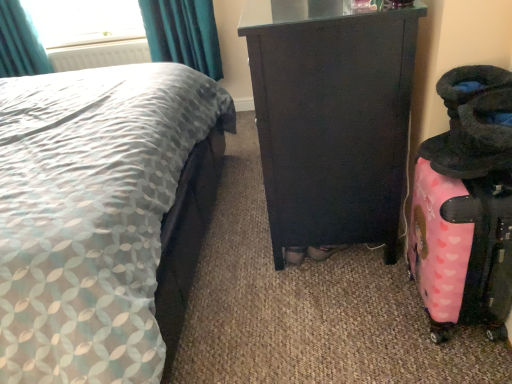
Question: Does teal fabric curtain at upper left turn towards matte gray fabric bed at left?

Choices:
 (A) yes
 (B) no

Answer: (A)

Question: Is teal fabric curtain at upper left next to matte gray fabric bed at left?

Choices:
 (A) yes
 (B) no

Answer: (B)

Question: Considering the relative positions of teal fabric curtain at upper left and matte gray fabric bed at left in the image provided, is teal fabric curtain at upper left to the right of matte gray fabric bed at left from the viewer's perspective?

Choices:
 (A) yes
 (B) no

Answer: (B)

Question: Is teal fabric curtain at upper left oriented away from matte gray fabric bed at left?

Choices:
 (A) yes
 (B) no

Answer: (B)

Question: Does teal fabric curtain at upper left appear on the left side of matte gray fabric bed at left?

Choices:
 (A) no
 (B) yes

Answer: (B)

Question: Is point (325, 44) closer or farther from the camera than point (64, 147)?

Choices:
 (A) closer
 (B) farther

Answer: (A)

Question: Considering the positions of matte black cabinet at center and matte gray fabric bed at left in the image, is matte black cabinet at center wider or thinner than matte gray fabric bed at left?

Choices:
 (A) wide
 (B) thin

Answer: (B)

Question: Based on their sizes in the image, would you say matte black cabinet at center is bigger or smaller than matte gray fabric bed at left?

Choices:
 (A) big
 (B) small

Answer: (B)

Question: Considering their positions, is matte black cabinet at center located in front of or behind matte gray fabric bed at left?

Choices:
 (A) front
 (B) behind

Answer: (B)

Question: Is matte black cabinet at center in front of or behind white plastic radiator at upper left in the image?

Choices:
 (A) front
 (B) behind

Answer: (A)

Question: In terms of size, does matte black cabinet at center appear bigger or smaller than white plastic radiator at upper left?

Choices:
 (A) small
 (B) big

Answer: (B)

Question: Considering the positions of matte black cabinet at center and white plastic radiator at upper left in the image, is matte black cabinet at center wider or thinner than white plastic radiator at upper left?

Choices:
 (A) wide
 (B) thin

Answer: (A)

Question: Is matte black cabinet at center situated inside white plastic radiator at upper left or outside?

Choices:
 (A) outside
 (B) inside

Answer: (A)

Question: Considering the positions of point (45, 281) and point (435, 286), is point (45, 281) closer or farther from the camera than point (435, 286)?

Choices:
 (A) closer
 (B) farther

Answer: (A)

Question: Relative to pink matte suitcase at right, is matte gray fabric bed at left in front or behind?

Choices:
 (A) front
 (B) behind

Answer: (A)